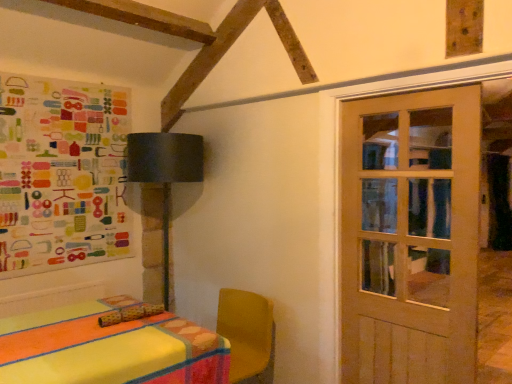
Find the location of a particular element. free spot above colorful paper collage at upper left (from a real-world perspective) is located at coordinates pyautogui.click(x=66, y=79).